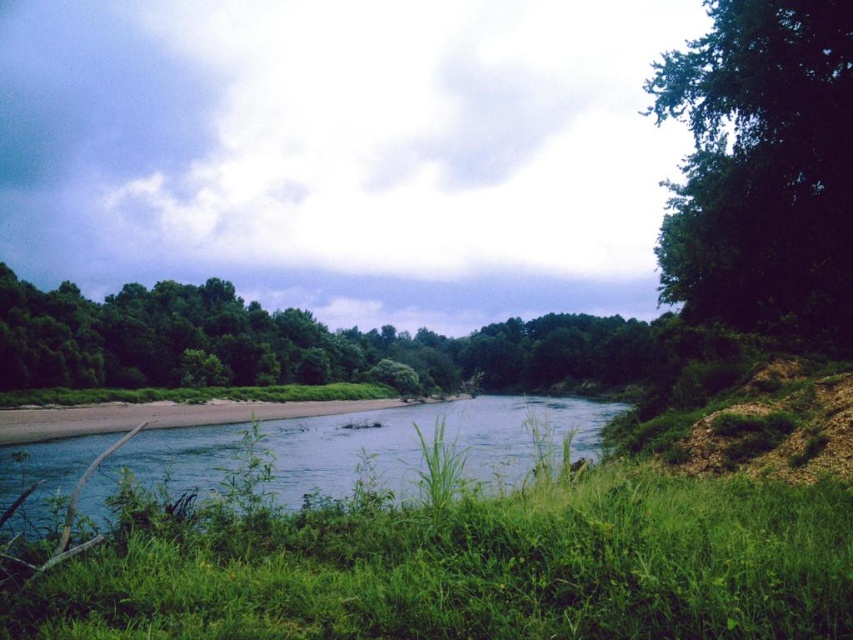
You are a kayaker planning to navigate the river shown. You need to choose a route that allows your kayak to pass through the widest possible section. Based on the scene, which area between the clear blue water at center and the brown sandy shore at lower left should you aim for?

The clear blue water at center has a larger width than the brown sandy shore at lower left, so you should aim for the clear blue water at center to pass through the widest section.

You are standing at the brown sandy shore at lower left and want to reach the green leafy tree at upper right. Which direction should you move to get closer to the tree?

To reach the green leafy tree at upper right from the brown sandy shore at lower left, you should move upward since the tree is located above the shore.

You are planning to set up a tent for a camping trip and need to choose between two locations. One is near the green leafy trees at center, and the other is near the brown sandy shore at lower left. Which location offers more vertical space for your tent due to height differences?

The green leafy trees at center are much taller than the brown sandy shore at lower left, so the area near the green leafy trees at center offers more vertical space for your tent due to their height.